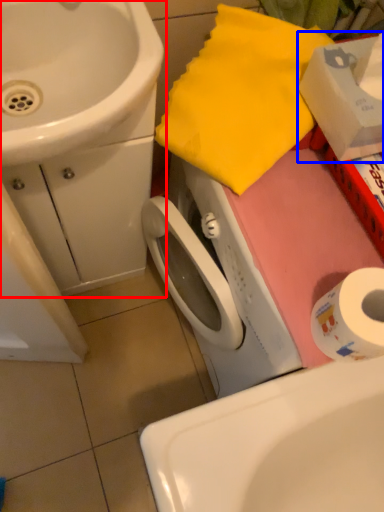
Question: Which of the following is the farthest to the observer, sink (highlighted by a red box) or box (highlighted by a blue box)?

Choices:
 (A) sink
 (B) box

Answer: (A)